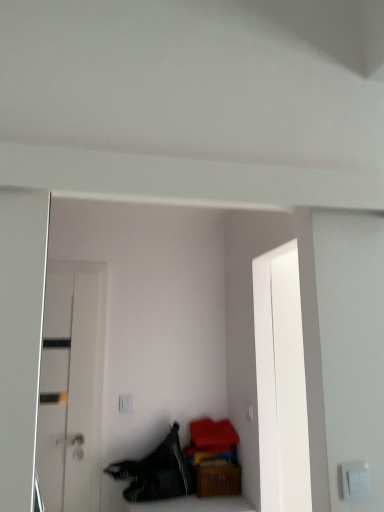
Question: Can you confirm if black textured fabric at lower left is bigger than white plastic switch at lower right?

Choices:
 (A) no
 (B) yes

Answer: (B)

Question: Is there a large distance between black textured fabric at lower left and white plastic switch at lower right?

Choices:
 (A) yes
 (B) no

Answer: (A)

Question: Does black textured fabric at lower left turn towards white plastic switch at lower right?

Choices:
 (A) yes
 (B) no

Answer: (A)

Question: From the image's perspective, is black textured fabric at lower left under white plastic switch at lower right?

Choices:
 (A) yes
 (B) no

Answer: (A)

Question: Is black textured fabric at lower left beside white plastic switch at lower right?

Choices:
 (A) yes
 (B) no

Answer: (B)

Question: From a real-world perspective, relative to black textured fabric at lower left, is white glossy door at left vertically above or below?

Choices:
 (A) above
 (B) below

Answer: (A)

Question: From the image's perspective, is white glossy door at left above or below black textured fabric at lower left?

Choices:
 (A) below
 (B) above

Answer: (B)

Question: Considering their positions, is white glossy door at left located in front of or behind black textured fabric at lower left?

Choices:
 (A) behind
 (B) front

Answer: (A)

Question: Considering the positions of white glossy door at left and black textured fabric at lower left in the image, is white glossy door at left bigger or smaller than black textured fabric at lower left?

Choices:
 (A) big
 (B) small

Answer: (B)

Question: From the image's perspective, is black textured fabric at lower left above or below white glossy door at left?

Choices:
 (A) above
 (B) below

Answer: (B)

Question: Considering the positions of point (134, 465) and point (94, 490), is point (134, 465) closer or farther from the camera than point (94, 490)?

Choices:
 (A) closer
 (B) farther

Answer: (B)

Question: Considering the positions of black textured fabric at lower left and white glossy door at left in the image, is black textured fabric at lower left wider or thinner than white glossy door at left?

Choices:
 (A) thin
 (B) wide

Answer: (B)

Question: Looking at the image, does black textured fabric at lower left seem bigger or smaller compared to white glossy door at left?

Choices:
 (A) small
 (B) big

Answer: (B)

Question: Is black textured fabric at lower left inside or outside of white plastic switch at lower right?

Choices:
 (A) inside
 (B) outside

Answer: (B)

Question: Would you say black textured fabric at lower left is to the left or to the right of white plastic switch at lower right in the picture?

Choices:
 (A) right
 (B) left

Answer: (B)